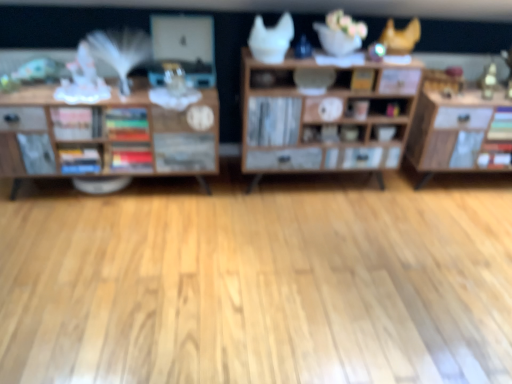
Question: Based on their positions, is multicolored hardcover books at center, the second book from the right, located to the left or right of wooden cabinet at center, the second shelf when ordered from left to right?

Choices:
 (A) left
 (B) right

Answer: (A)

Question: From a real-world perspective, relative to wooden cabinet at center, the second shelf when ordered from left to right, is multicolored hardcover books at center, which appears as the third book when viewed from the left, vertically above or below?

Choices:
 (A) below
 (B) above

Answer: (B)

Question: Based on their relative distances, which object is nearer to the wooden cabinet at center, the first shelf positioned from the right?

Choices:
 (A) hardcover book at left, which is the fourth book from right to left
 (B) multicolored hardcover books at center, the second book from the right
 (C) wooden bookshelf at left, marked as the second shelf in a right-to-left arrangement
 (D) matte white bowl at center
 (E) yellow matte book at center, acting as the first book starting from the right

Answer: (E)

Question: Estimate the real-world distances between objects in this image. Which object is closer to the yellow matte book at center, the 4th book when ordered from left to right?

Choices:
 (A) matte white bowl at center
 (B) hardcover book at left, which is the fourth book from right to left
 (C) multicolored hardcover books at center, the second book from the right
 (D) wooden bookshelf at left, marked as the second shelf in a right-to-left arrangement
 (E) wooden cabinet at center, the first shelf positioned from the right

Answer: (A)